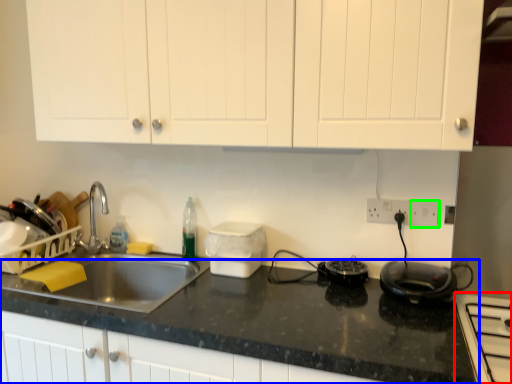
Question: Based on their relative distances, which object is nearer to home appliance (highlighted by a red box)? Choose from countertop (highlighted by a blue box) and electric outlet (highlighted by a green box).

Choices:
 (A) countertop
 (B) electric outlet

Answer: (A)